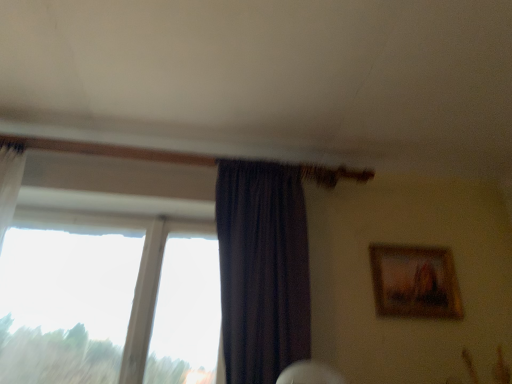
Where is `dark purple sheer at center`? The width and height of the screenshot is (512, 384). dark purple sheer at center is located at coordinates 262,269.

Describe the element at coordinates (108, 300) in the screenshot. I see `transparent glass window at left` at that location.

The height and width of the screenshot is (384, 512). Find the location of `wooden framed painting at upper right`. wooden framed painting at upper right is located at coordinates (415, 282).

Looking at this image, from a real-world perspective, who is located lower, transparent glass window at left or wooden framed painting at upper right?

From a 3D spatial view, transparent glass window at left is below.

Is transparent glass window at left not close to wooden framed painting at upper right?

Absolutely, transparent glass window at left is distant from wooden framed painting at upper right.

In the scene shown: Considering the sizes of objects transparent glass window at left and wooden framed painting at upper right in the image provided, who is wider, transparent glass window at left or wooden framed painting at upper right?

With larger width is transparent glass window at left.

Considering the sizes of objects transparent glass window at left and wooden framed painting at upper right in the image provided, who is shorter, transparent glass window at left or wooden framed painting at upper right?

wooden framed painting at upper right.

Is transparent glass window at left beside dark purple sheer at center?

No.

Is dark purple sheer at center a part of transparent glass window at left?

No, dark purple sheer at center is located outside of transparent glass window at left.

Is transparent glass window at left facing away from dark purple sheer at center?

No, transparent glass window at left's orientation is not away from dark purple sheer at center.

Is transparent glass window at left in front of or behind dark purple sheer at center in the image?

In the image, transparent glass window at left appears behind dark purple sheer at center.

Is wooden framed painting at upper right smaller than transparent glass window at left?

Correct, wooden framed painting at upper right occupies less space than transparent glass window at left.

Is wooden framed painting at upper right aimed at transparent glass window at left?

No.

Considering the relative positions of wooden framed painting at upper right and transparent glass window at left in the image provided, is wooden framed painting at upper right to the left or to the right of transparent glass window at left?

From the image, it's evident that wooden framed painting at upper right is to the right of transparent glass window at left.

Does wooden framed painting at upper right come in front of transparent glass window at left?

No, wooden framed painting at upper right is behind transparent glass window at left.

Is dark purple sheer at center next to wooden framed painting at upper right?

No, dark purple sheer at center is not beside wooden framed painting at upper right.

Considering the positions of objects dark purple sheer at center and wooden framed painting at upper right in the image provided, who is in front, dark purple sheer at center or wooden framed painting at upper right?

Positioned in front is dark purple sheer at center.

Would you say dark purple sheer at center is inside or outside wooden framed painting at upper right?

dark purple sheer at center lies outside wooden framed painting at upper right.

Is dark purple sheer at center bigger than wooden framed painting at upper right?

Indeed, dark purple sheer at center has a larger size compared to wooden framed painting at upper right.

Looking at this image, from a real-world perspective, which is physically below, dark purple sheer at center or transparent glass window at left?

From a 3D spatial view, transparent glass window at left is below.

Considering the relative sizes of dark purple sheer at center and transparent glass window at left in the image provided, is dark purple sheer at center shorter than transparent glass window at left?

In fact, dark purple sheer at center may be taller than transparent glass window at left.

At what (x,y) coordinates should I click in order to perform the action: click on curtain located on the right of transparent glass window at left. Please return your answer as a coordinate pair (x, y). Looking at the image, I should click on (262, 269).

From the image's perspective, who appears lower, dark purple sheer at center or transparent glass window at left?

transparent glass window at left.

Considering the positions of objects wooden framed painting at upper right and dark purple sheer at center in the image provided, who is more to the right, wooden framed painting at upper right or dark purple sheer at center?

From the viewer's perspective, wooden framed painting at upper right appears more on the right side.

Can you see wooden framed painting at upper right touching dark purple sheer at center?

No, wooden framed painting at upper right is not beside dark purple sheer at center.

From a real-world perspective, is wooden framed painting at upper right on top of dark purple sheer at center?

Yes, from a real-world perspective, wooden framed painting at upper right is above dark purple sheer at center.

Considering the sizes of wooden framed painting at upper right and dark purple sheer at center in the image, is wooden framed painting at upper right wider or thinner than dark purple sheer at center?

wooden framed painting at upper right is thinner than dark purple sheer at center.

At what (x,y) coordinates should I click in order to perform the action: click on picture frame that appears behind the transparent glass window at left. Please return your answer as a coordinate pair (x, y). Image resolution: width=512 pixels, height=384 pixels. Looking at the image, I should click on (415, 282).

The height and width of the screenshot is (384, 512). I want to click on window below the dark purple sheer at center (from a real-world perspective), so click(108, 300).

Which object lies nearer to the anchor point dark purple sheer at center, wooden framed painting at upper right or transparent glass window at left?

transparent glass window at left is positioned closer to the anchor dark purple sheer at center.

Looking at the image, which one is located further to transparent glass window at left, wooden framed painting at upper right or dark purple sheer at center?

The object further to transparent glass window at left is wooden framed painting at upper right.

Based on their spatial positions, is transparent glass window at left or dark purple sheer at center closer to wooden framed painting at upper right?

dark purple sheer at center.

Consider the image. Estimate the real-world distances between objects in this image. Which object is further from dark purple sheer at center, transparent glass window at left or wooden framed painting at upper right?

wooden framed painting at upper right is further to dark purple sheer at center.

Estimate the real-world distances between objects in this image. Which object is further from wooden framed painting at upper right, dark purple sheer at center or transparent glass window at left?

transparent glass window at left.

Based on their spatial positions, is dark purple sheer at center or wooden framed painting at upper right closer to transparent glass window at left?

Among the two, dark purple sheer at center is located nearer to transparent glass window at left.

This screenshot has width=512, height=384. Find the location of `curtain located between transparent glass window at left and wooden framed painting at upper right in the left-right direction`. curtain located between transparent glass window at left and wooden framed painting at upper right in the left-right direction is located at coordinates (262, 269).